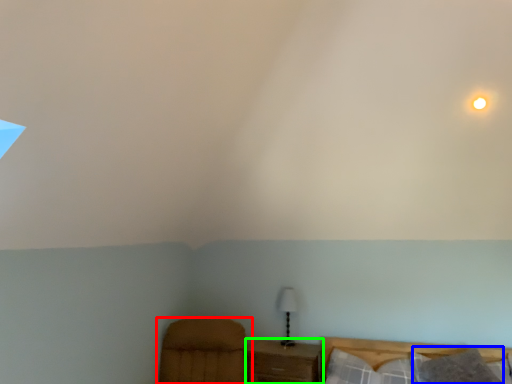
Question: Considering the real-world distances, which object is farthest from furniture (highlighted by a red box)? pillow (highlighted by a blue box) or nightstand (highlighted by a green box)?

Choices:
 (A) pillow
 (B) nightstand

Answer: (A)